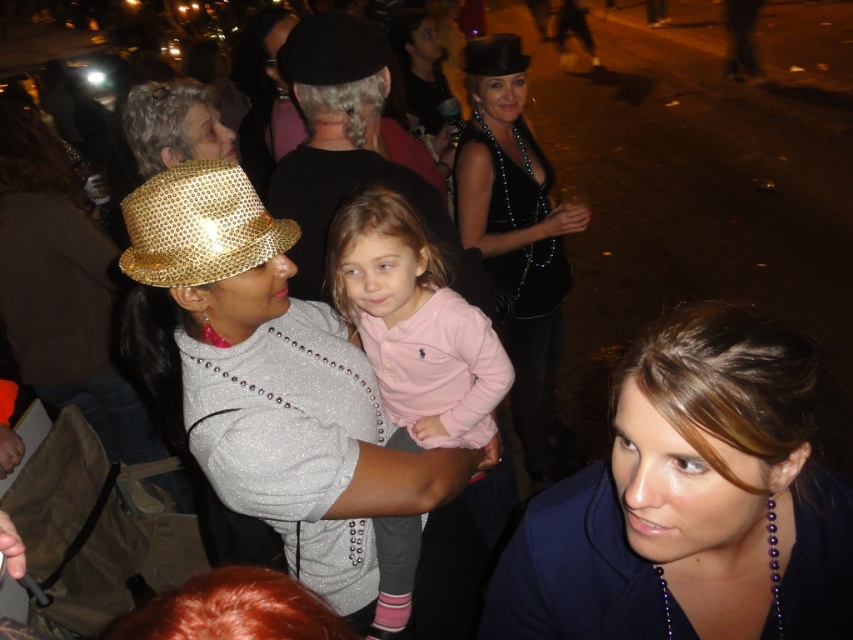
Question: Estimate the real-world distances between objects in this image. Which object is farther from the shiny black hat at upper center?

Choices:
 (A) shiny black dress at center
 (B) black felt hat at upper center

Answer: (B)

Question: Can you confirm if blue fabric at center is thinner than shiny black hat at upper center?

Choices:
 (A) no
 (B) yes

Answer: (A)

Question: Which of the following is the closest to the observer?

Choices:
 (A) shiny black hat at upper center
 (B) gold sequined hat at center
 (C) black felt hat at upper center

Answer: (B)

Question: Among these points, which one is nearest to the camera?

Choices:
 (A) (500, 44)
 (B) (241, 234)
 (C) (442, 577)

Answer: (B)

Question: Can you confirm if gold sequined hat at center is positioned above shiny gold hat at upper left?

Choices:
 (A) yes
 (B) no

Answer: (B)

Question: Where is blue fabric at center located in relation to shiny black hat at upper center in the image?

Choices:
 (A) below
 (B) above

Answer: (A)